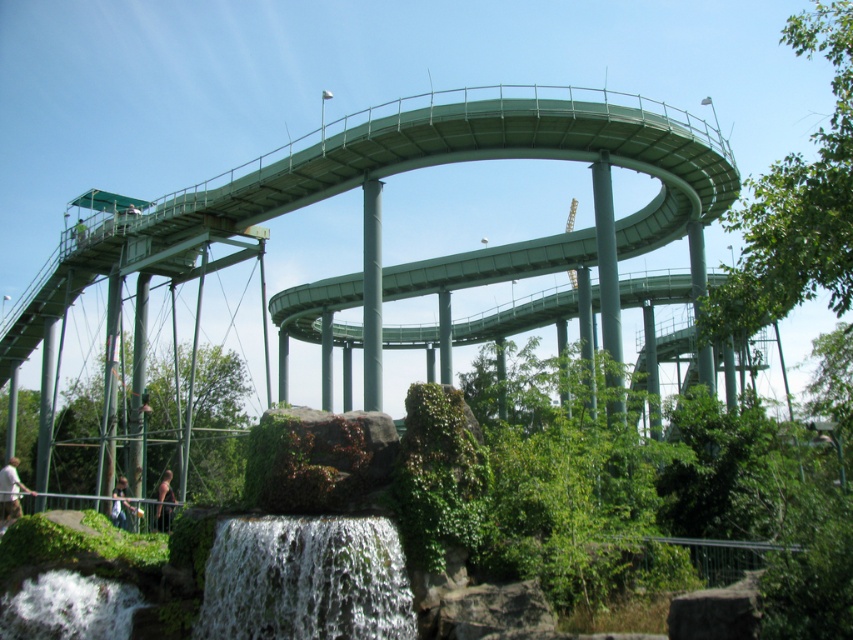
Which is below, white frothy water at lower center or light brown hair at lower center?

Positioned lower is light brown hair at lower center.

Is white frothy water at lower center bigger than light brown hair at lower center?

Actually, white frothy water at lower center might be smaller than light brown hair at lower center.

Is point (231, 636) positioned before point (122, 525)?

Yes, point (231, 636) is closer to viewer.

The width and height of the screenshot is (853, 640). What are the coordinates of `white frothy water at lower center` in the screenshot? It's located at (305, 580).

Which is in front, point (376, 150) or point (166, 484)?

Point (376, 150) is more forward.

Does green metallic bridge at upper center have a lesser width compared to dark brown leather jacket at lower center?

Incorrect, green metallic bridge at upper center's width is not less than dark brown leather jacket at lower center's.

Find the location of a particular element. This screenshot has height=640, width=853. green metallic bridge at upper center is located at coordinates (378, 186).

Where is `green metallic bridge at upper center`? Image resolution: width=853 pixels, height=640 pixels. green metallic bridge at upper center is located at coordinates (378, 186).

Is point (480, 250) farther from camera compared to point (408, 634)?

That is True.

Between green metallic bridge at upper center and white frothy water at lower center, which one has more height?

green metallic bridge at upper center

Does point (432, 132) lie behind point (218, 586)?

That is True.

The width and height of the screenshot is (853, 640). Find the location of `green metallic bridge at upper center`. green metallic bridge at upper center is located at coordinates (378, 186).